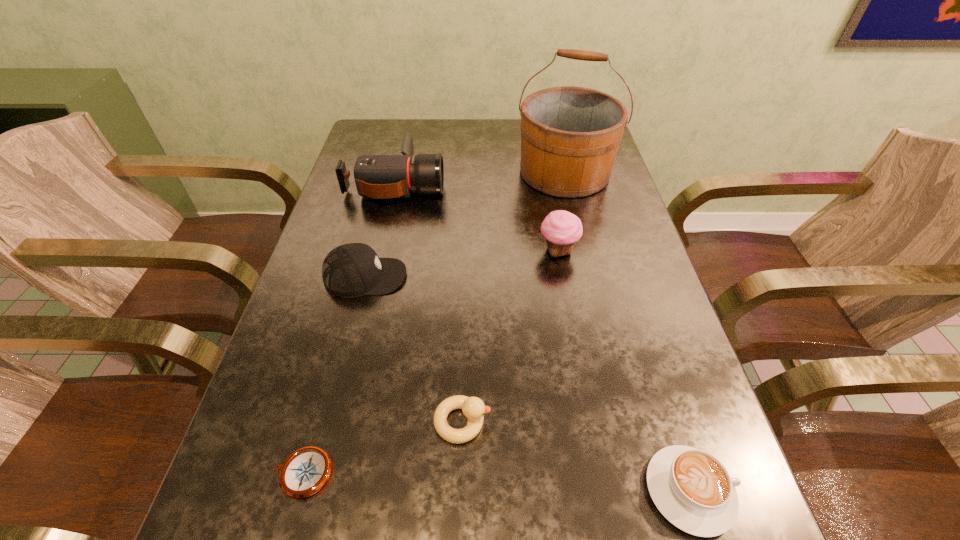
Locate an element on the screen. This screenshot has height=540, width=960. free region located on the front of the cupcake is located at coordinates (582, 382).

Image resolution: width=960 pixels, height=540 pixels. I want to click on free space located on the front-facing side of the fourth tallest object, so click(x=521, y=276).

Identify the location of free space located at the beak of the fifth farthest object. The height and width of the screenshot is (540, 960). (542, 422).

Where is `vacant area located on the right of the compass`? The height and width of the screenshot is (540, 960). vacant area located on the right of the compass is located at coordinates (402, 473).

In order to click on object that is at the far edge in this screenshot , I will do `click(570, 136)`.

You are a GUI agent. You are given a task and a screenshot of the screen. Output one action in this format:
    pyautogui.click(x=<x>, y=<y>)
    Task: Click on the camcorder that is positioned at the left edge
    
    Given the screenshot: What is the action you would take?
    pyautogui.click(x=376, y=176)

The height and width of the screenshot is (540, 960). Find the location of `cap at the left edge`. cap at the left edge is located at coordinates (353, 269).

Where is `compass positioned at the left edge`? This screenshot has height=540, width=960. compass positioned at the left edge is located at coordinates (305, 471).

This screenshot has height=540, width=960. Identify the location of bucket present at the right edge. (570, 136).

This screenshot has width=960, height=540. I want to click on cupcake located at the right edge, so click(x=562, y=229).